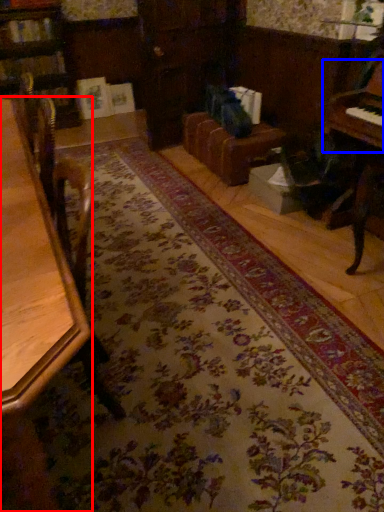
Question: Among these objects, which one is farthest to the camera, table (highlighted by a red box) or piano (highlighted by a blue box)?

Choices:
 (A) table
 (B) piano

Answer: (B)